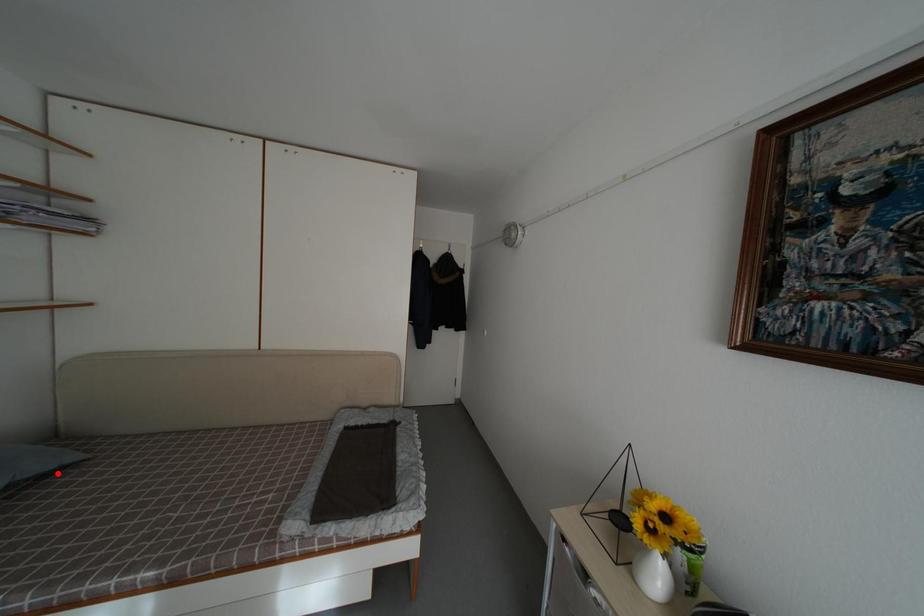
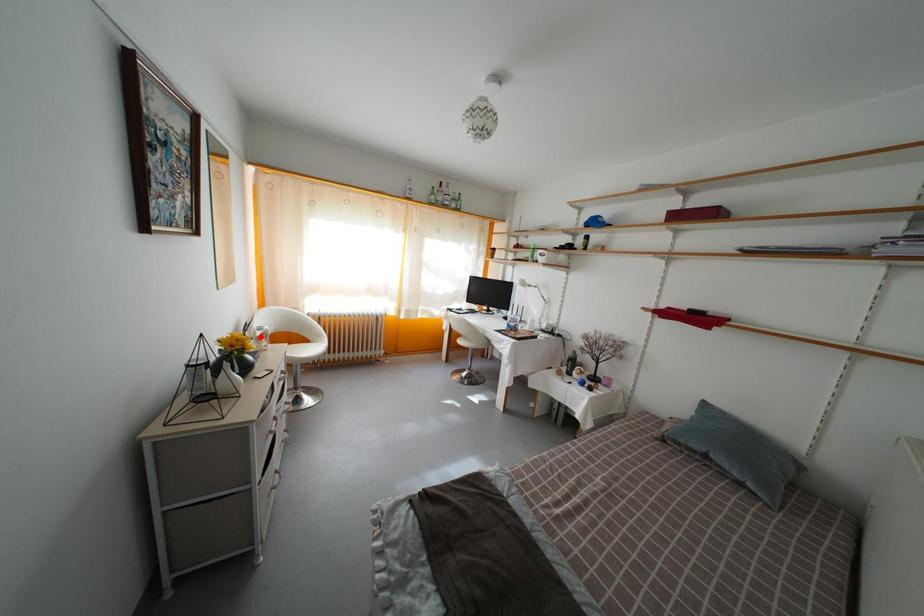
I am providing you with two images of the same scene from different viewpoints. A red point is marked on the first image and another point is marked on the second image. Are the points marked in image1 and image2 representing the same 3D position?

No